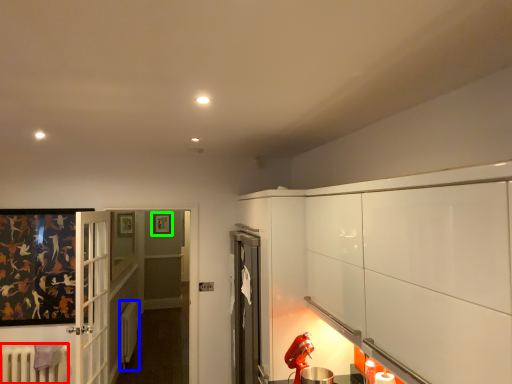
Question: Which object is the closest to the radiator (highlighted by a red box)? Choose among these: radiator (highlighted by a blue box) or picture frame (highlighted by a green box).

Choices:
 (A) radiator
 (B) picture frame

Answer: (A)